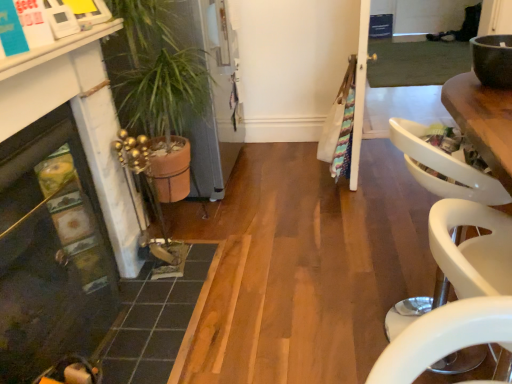
Identify the location of vacant area situated below dark gray tile at lower left (from a real-world perspective). The image size is (512, 384). (154, 311).